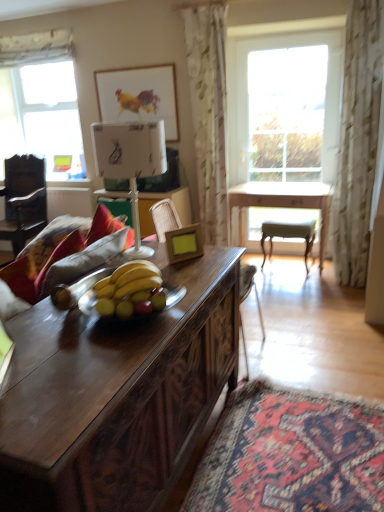
Question: Can you confirm if light wood table at center is thinner than watercolor paper picture frame at upper center, the second picture frame viewed from the right?

Choices:
 (A) yes
 (B) no

Answer: (B)

Question: From the image's perspective, would you say light wood table at center is shown under watercolor paper picture frame at upper center, marked as the 1th picture frame in a back-to-front arrangement?

Choices:
 (A) yes
 (B) no

Answer: (A)

Question: Is light wood table at center in front of watercolor paper picture frame at upper center, marked as the 2th picture frame in a bottom-to-top arrangement?

Choices:
 (A) no
 (B) yes

Answer: (B)

Question: From a real-world perspective, is light wood table at center positioned over watercolor paper picture frame at upper center, marked as the 2th picture frame in a bottom-to-top arrangement, based on gravity?

Choices:
 (A) yes
 (B) no

Answer: (B)

Question: Considering the relative positions of light wood table at center and watercolor paper picture frame at upper center, the second picture frame viewed from the right, in the image provided, is light wood table at center to the right of watercolor paper picture frame at upper center, the second picture frame viewed from the right, from the viewer's perspective?

Choices:
 (A) no
 (B) yes

Answer: (B)

Question: Does light wood table at center contain watercolor paper picture frame at upper center, the second picture frame viewed from the right?

Choices:
 (A) no
 (B) yes

Answer: (A)

Question: Does light wood table at center contain white paper lampshade at center?

Choices:
 (A) no
 (B) yes

Answer: (A)

Question: From a real-world perspective, is light wood table at center on top of white paper lampshade at center?

Choices:
 (A) no
 (B) yes

Answer: (A)

Question: Can you confirm if light wood table at center is smaller than white paper lampshade at center?

Choices:
 (A) no
 (B) yes

Answer: (A)

Question: From a real-world perspective, is light wood table at center beneath white paper lampshade at center?

Choices:
 (A) no
 (B) yes

Answer: (B)

Question: Does light wood table at center touch white paper lampshade at center?

Choices:
 (A) yes
 (B) no

Answer: (B)

Question: Does light wood table at center lie in front of white paper lampshade at center?

Choices:
 (A) yes
 (B) no

Answer: (B)

Question: Is clear glass window at upper left, which appears as the 1th window when viewed from the left, far away from wooden swivel chair at center?

Choices:
 (A) yes
 (B) no

Answer: (A)